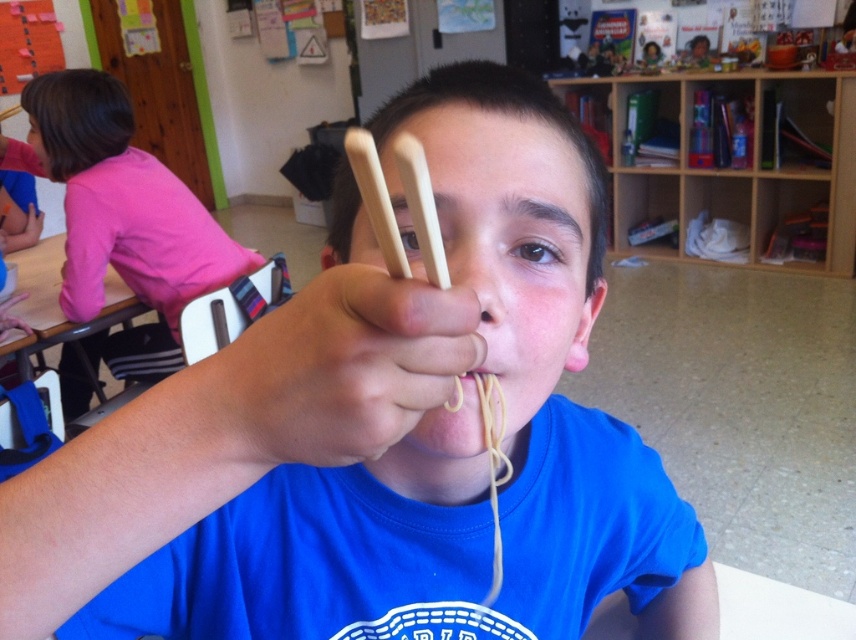
Question: Does wooden chopsticks at center appear over pink fabric shirt at upper left?

Choices:
 (A) no
 (B) yes

Answer: (A)

Question: Based on their relative distances, which object is farther from the wooden chopsticks at center?

Choices:
 (A) pink fabric shirt at upper left
 (B) yellow matte spaghetti at center

Answer: (A)

Question: Estimate the real-world distances between objects in this image. Which object is closer to the pink fabric shirt at upper left?

Choices:
 (A) yellow matte spaghetti at center
 (B) wooden chopsticks at center

Answer: (A)

Question: Is wooden chopsticks at center to the right of yellow matte spaghetti at center from the viewer's perspective?

Choices:
 (A) no
 (B) yes

Answer: (A)

Question: Does wooden chopsticks at center lie behind yellow matte spaghetti at center?

Choices:
 (A) no
 (B) yes

Answer: (A)

Question: Which object appears closest to the camera in this image?

Choices:
 (A) wooden chopsticks at center
 (B) pink fabric shirt at upper left
 (C) yellow matte spaghetti at center

Answer: (A)